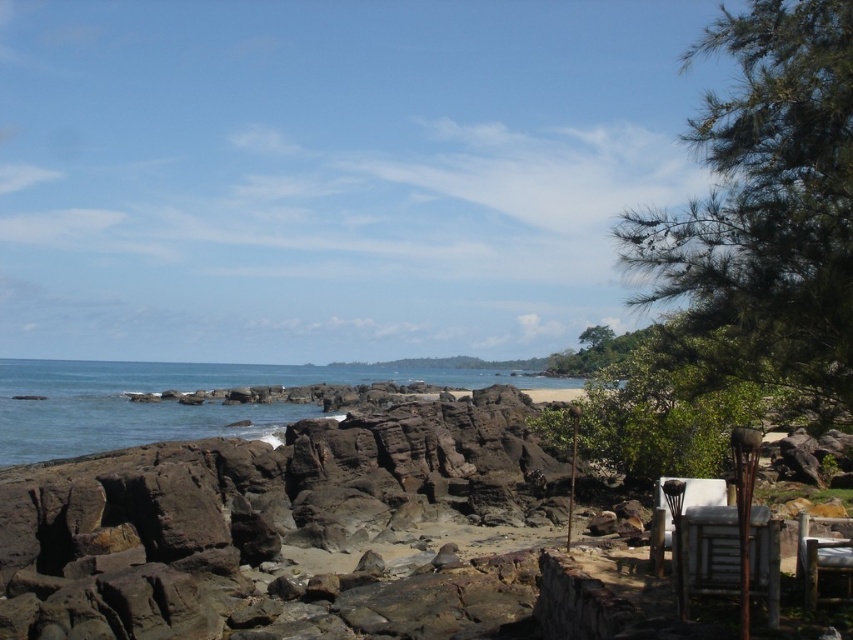
Is white wooden chair at lower right positioned behind wooden chair at lower right?

No, white wooden chair at lower right is in front of wooden chair at lower right.

Is white wooden chair at lower right smaller than wooden chair at lower right?

No, white wooden chair at lower right is not smaller than wooden chair at lower right.

Is point (701, 518) positioned after point (837, 596)?

That is False.

Identify the location of white wooden chair at lower right. Image resolution: width=853 pixels, height=640 pixels. (709, 550).

Does brown rock beach at center appear on the right side of wooden chair at lower right?

No, brown rock beach at center is not to the right of wooden chair at lower right.

Does point (755, 595) come closer to viewer compared to point (839, 545)?

That is True.

Locate an element on the screen. This screenshot has width=853, height=640. brown rock beach at center is located at coordinates (283, 532).

The height and width of the screenshot is (640, 853). I want to click on brown rock beach at center, so click(x=283, y=532).

Which is more to the right, blue water at center or wooden chair at lower right?

wooden chair at lower right

Identify the location of blue water at center. (183, 404).

Image resolution: width=853 pixels, height=640 pixels. What do you see at coordinates (183, 404) in the screenshot? I see `blue water at center` at bounding box center [183, 404].

Where is `blue water at center`? Image resolution: width=853 pixels, height=640 pixels. blue water at center is located at coordinates (183, 404).